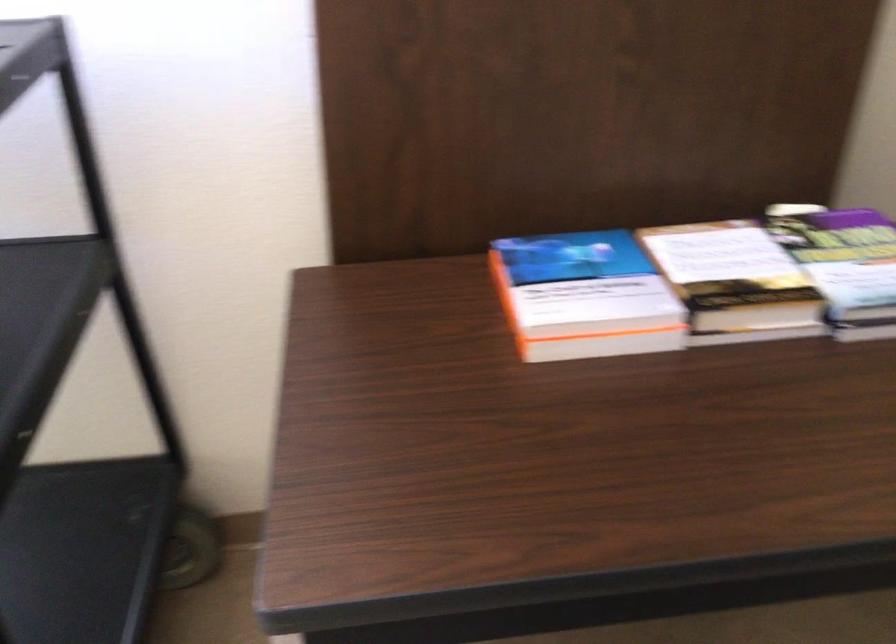
Find the location of a particular element. blue and white book is located at coordinates (584, 296).